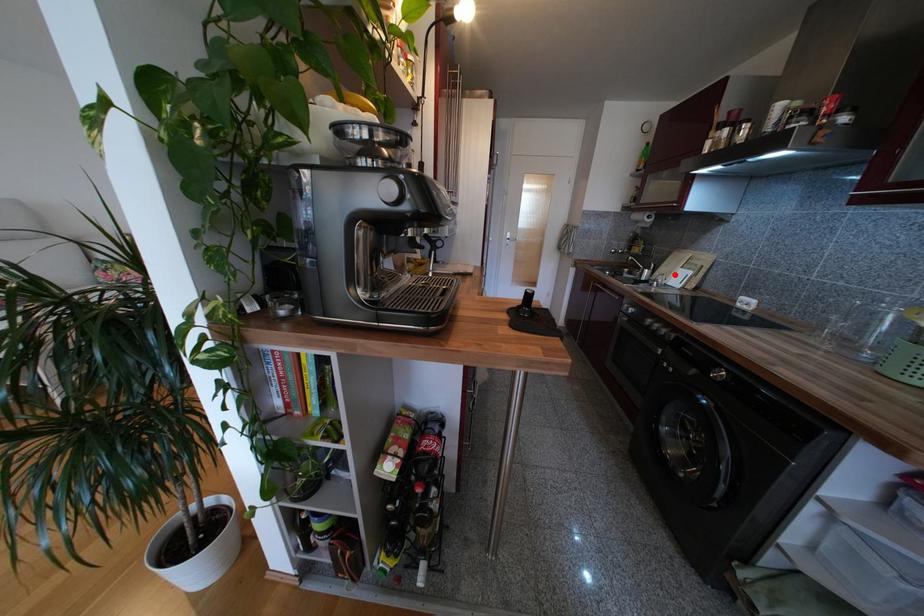
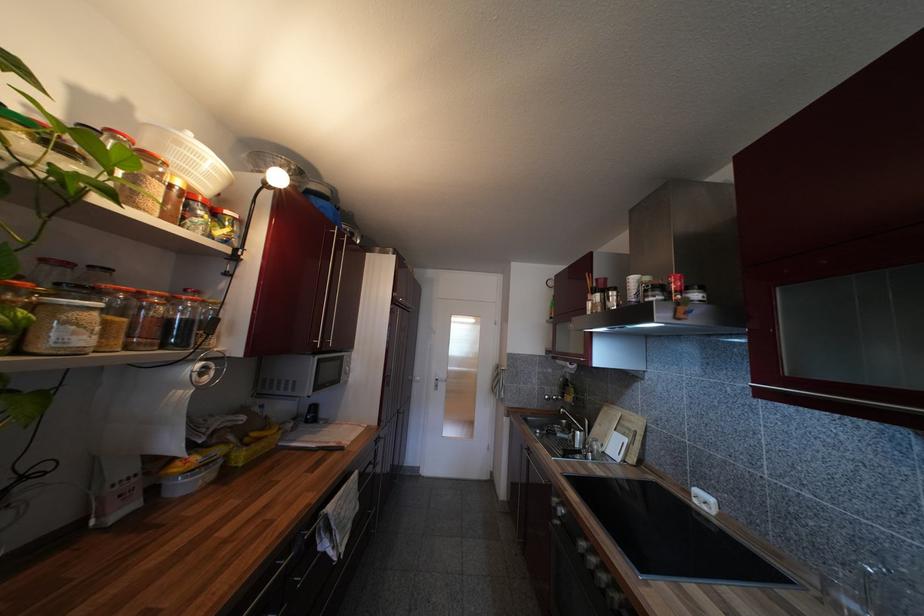
Question: I am providing you with two images of the same scene from different viewpoints. In image1, a red point is highlighted. Considering the same 3D point in image2, which of the following is correct?

Choices:
 (A) It is closer
 (B) It is farther

Answer: (B)